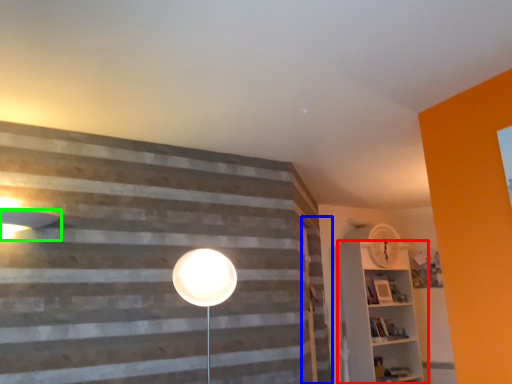
Question: Which is farther away from shelf (highlighted by a red box)? barn door (highlighted by a blue box) or lamp (highlighted by a green box)?

Choices:
 (A) barn door
 (B) lamp

Answer: (B)